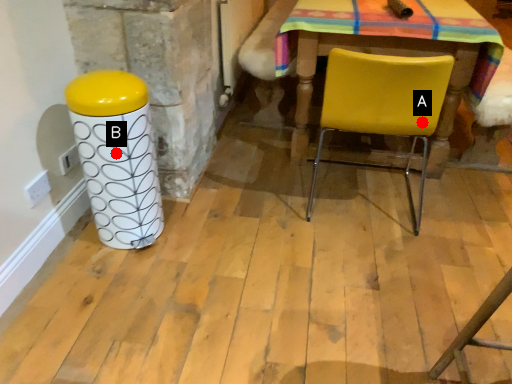
Question: Two points are circled on the image, labeled by A and B beside each circle. Among these points, which one is nearest to the camera?

Choices:
 (A) A is closer
 (B) B is closer

Answer: (B)